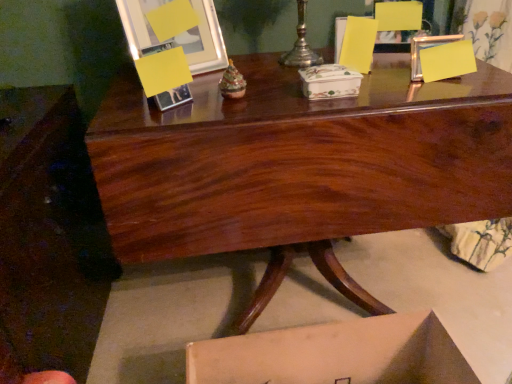
The image size is (512, 384). What are the coordinates of `free space in front of metallic silver picture frame at upper left` in the screenshot? It's located at (177, 103).